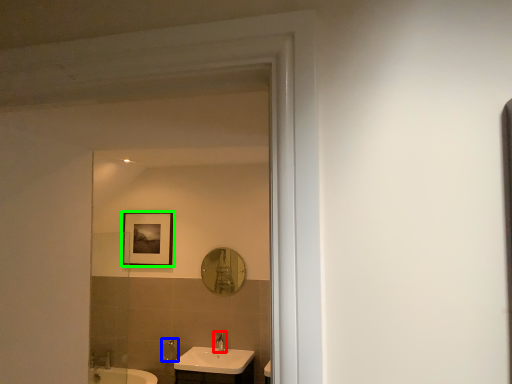
Question: Which object is the closest to the tap (highlighted by a red box)? Choose among these: shower (highlighted by a blue box) or picture frame (highlighted by a green box).

Choices:
 (A) shower
 (B) picture frame

Answer: (A)